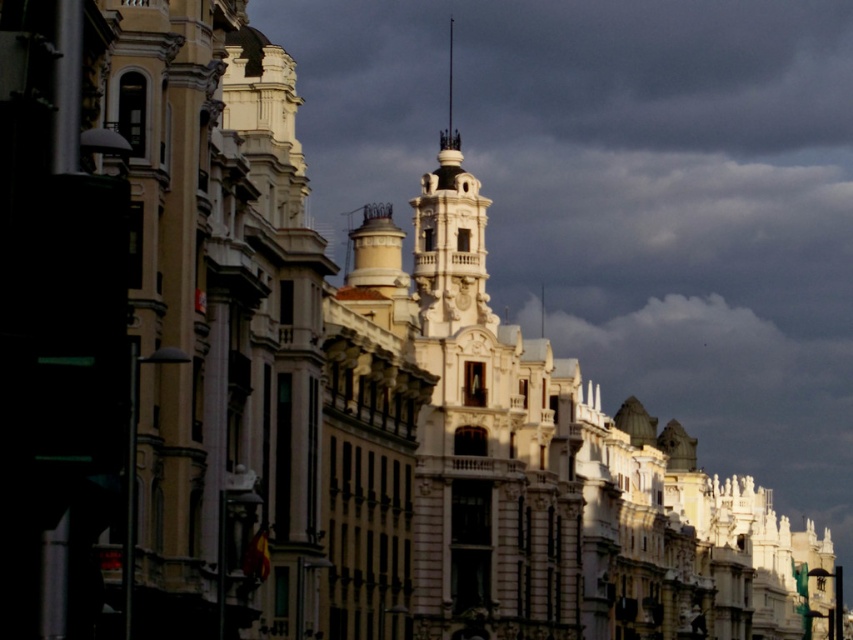
Is metallic streetlight at left behind black metal spire at upper center?

No, metallic streetlight at left is in front of black metal spire at upper center.

Does point (107, 195) lie behind point (453, 140)?

No, (107, 195) is in front of (453, 140).

Does point (7, 189) come closer to viewer compared to point (451, 129)?

That is True.

You are a GUI agent. You are given a task and a screenshot of the screen. Output one action in this format:
    pyautogui.click(x=<x>, y=<y>)
    Task: Click on the metallic streetlight at left
    The height and width of the screenshot is (640, 853).
    Given the screenshot: What is the action you would take?
    pyautogui.click(x=56, y=320)